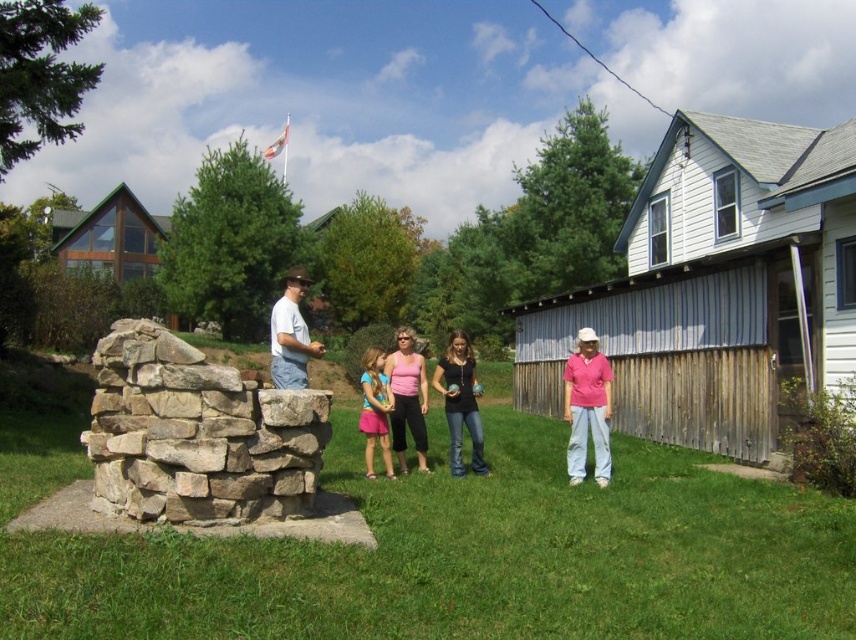
In the scene shown: Does white cotton shirt at center have a greater height compared to pink fabric dress at center?

Indeed, white cotton shirt at center has a greater height compared to pink fabric dress at center.

Who is shorter, white cotton shirt at center or pink fabric dress at center?

Standing shorter between the two is pink fabric dress at center.

What do you see at coordinates (290, 336) in the screenshot? I see `white cotton shirt at center` at bounding box center [290, 336].

Image resolution: width=856 pixels, height=640 pixels. Find the location of `white cotton shirt at center`. white cotton shirt at center is located at coordinates (290, 336).

Is pink cotton shirt at center to the right of pink fabric dress at center from the viewer's perspective?

Indeed, pink cotton shirt at center is positioned on the right side of pink fabric dress at center.

Is pink cotton shirt at center to the left of pink fabric dress at center from the viewer's perspective?

Incorrect, pink cotton shirt at center is not on the left side of pink fabric dress at center.

Between point (409, 387) and point (377, 416), which one is positioned in front?

Point (377, 416) is more forward.

Find the location of a particular element. The height and width of the screenshot is (640, 856). pink cotton shirt at center is located at coordinates (461, 401).

Does point (462, 372) come farther from viewer compared to point (283, 300)?

Yes, point (462, 372) is farther from viewer.

Which is behind, point (456, 429) or point (294, 282)?

The point (456, 429) is behind.

Identify the location of denim jeans at center. (461, 403).